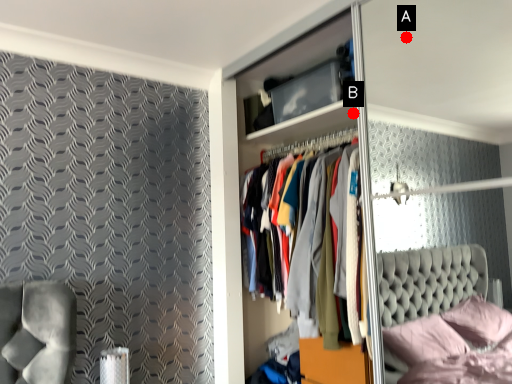
Question: Two points are circled on the image, labeled by A and B beside each circle. Which point is closer to the camera?

Choices:
 (A) A is closer
 (B) B is closer

Answer: (A)